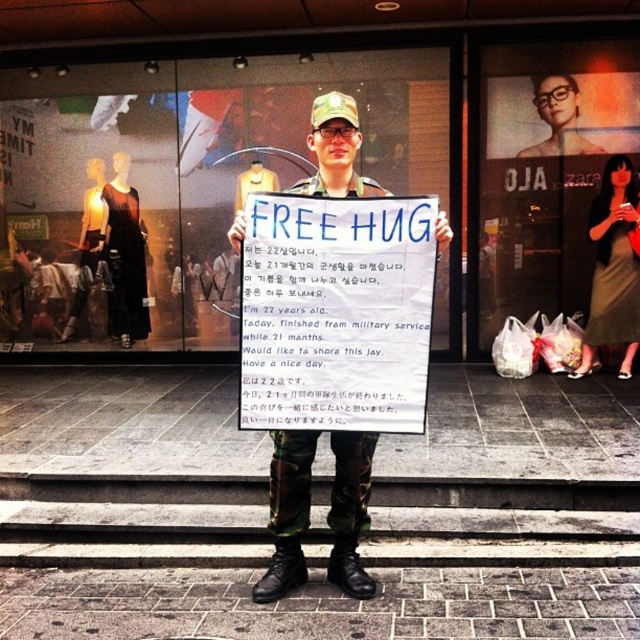
Question: Among these objects, which one is farthest from the camera?

Choices:
 (A) blue paper sign at center
 (B) matte black military uniform at center
 (C) camouflage fabric uniform at center
 (D) glass display at center

Answer: (D)

Question: Is glass display at center smaller than matte black military uniform at center?

Choices:
 (A) yes
 (B) no

Answer: (B)

Question: Considering the relative positions of glass display at center and matte black military uniform at center in the image provided, where is glass display at center located with respect to matte black military uniform at center?

Choices:
 (A) left
 (B) right

Answer: (A)

Question: Does blue paper sign at center appear under matte black military uniform at center?

Choices:
 (A) no
 (B) yes

Answer: (B)

Question: Which of the following is the closest to the observer?

Choices:
 (A) (307, 497)
 (B) (269, 321)
 (C) (557, 81)
 (D) (141, 332)

Answer: (B)

Question: Which of these objects is positioned closest to the matte black military uniform at center?

Choices:
 (A) camouflage fabric uniform at center
 (B) glass display at center
 (C) blue paper sign at center

Answer: (B)